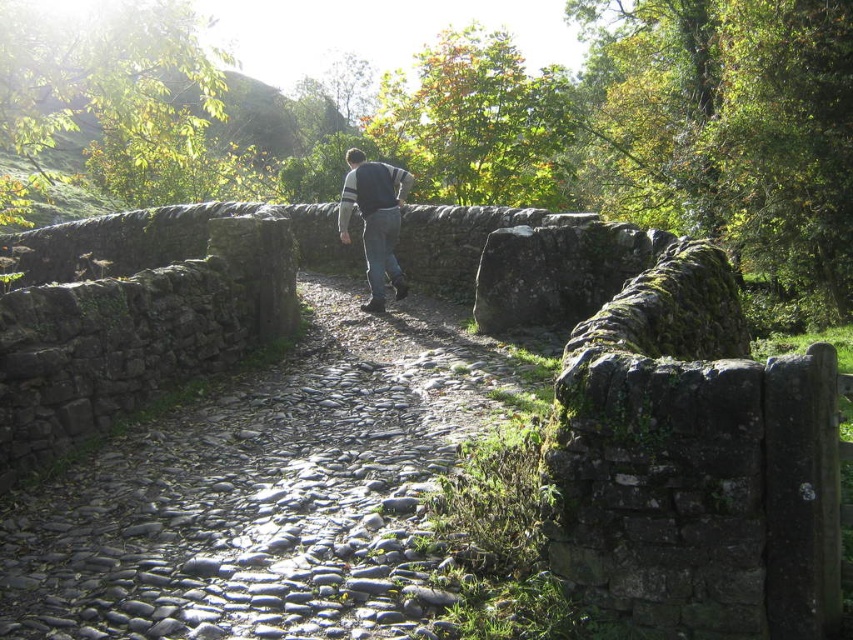
Question: Among these objects, which one is nearest to the camera?

Choices:
 (A) gray cobblestone trail at center
 (B) dark gray sweater at center

Answer: (A)

Question: Which point appears closest to the camera in this image?

Choices:
 (A) (363, 237)
 (B) (90, 515)

Answer: (B)

Question: Does gray cobblestone trail at center appear on the left side of dark gray sweater at center?

Choices:
 (A) no
 (B) yes

Answer: (A)

Question: Does gray cobblestone trail at center appear over dark gray sweater at center?

Choices:
 (A) no
 (B) yes

Answer: (A)

Question: Does gray cobblestone trail at center have a larger size compared to dark gray sweater at center?

Choices:
 (A) no
 (B) yes

Answer: (A)